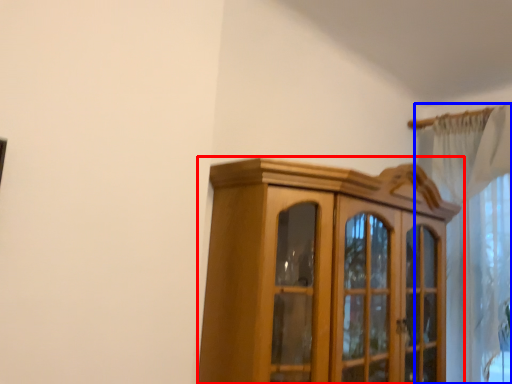
Question: Which object appears farthest to the camera in this image, cupboard (highlighted by a red box) or curtain (highlighted by a blue box)?

Choices:
 (A) cupboard
 (B) curtain

Answer: (B)